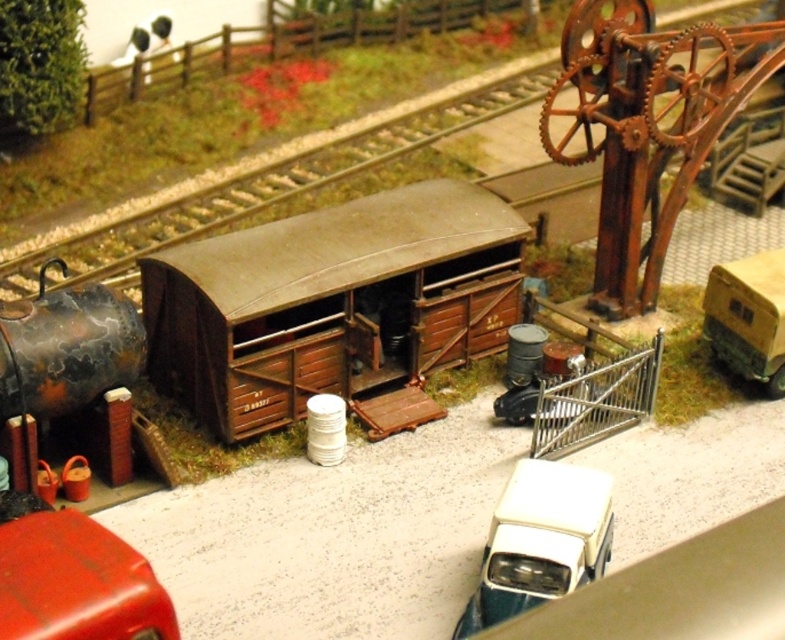
Image resolution: width=785 pixels, height=640 pixels. What do you see at coordinates (330, 301) in the screenshot? I see `brown wooden train car at center` at bounding box center [330, 301].

Does brown wooden train car at center have a lesser height compared to matte yellow trailer at right?

Incorrect, brown wooden train car at center's height does not fall short of matte yellow trailer at right's.

Where is `brown wooden train car at center`? The height and width of the screenshot is (640, 785). brown wooden train car at center is located at coordinates point(330,301).

Measure the distance between point [342,324] and camera.

The distance of point [342,324] from camera is 29.52 feet.

Identify the location of brown wooden train car at center. (330, 301).

Is point (157, 368) more distant than point (524, 508)?

Yes, it is.

The width and height of the screenshot is (785, 640). Identify the location of brown wooden train car at center. pyautogui.click(x=330, y=301).

Does point (557, 525) come in front of point (739, 300)?

Yes, it is.

Is point (488, 614) behind point (716, 307)?

No.

You are a GUI agent. You are given a task and a screenshot of the screen. Output one action in this format:
    pyautogui.click(x=<x>, y=<y>)
    Task: Click on the white glossy van at lower right
    Image resolution: width=785 pixels, height=640 pixels.
    Given the screenshot: What is the action you would take?
    pyautogui.click(x=539, y=540)

Identify the location of white glossy van at lower right. The width and height of the screenshot is (785, 640). (539, 540).